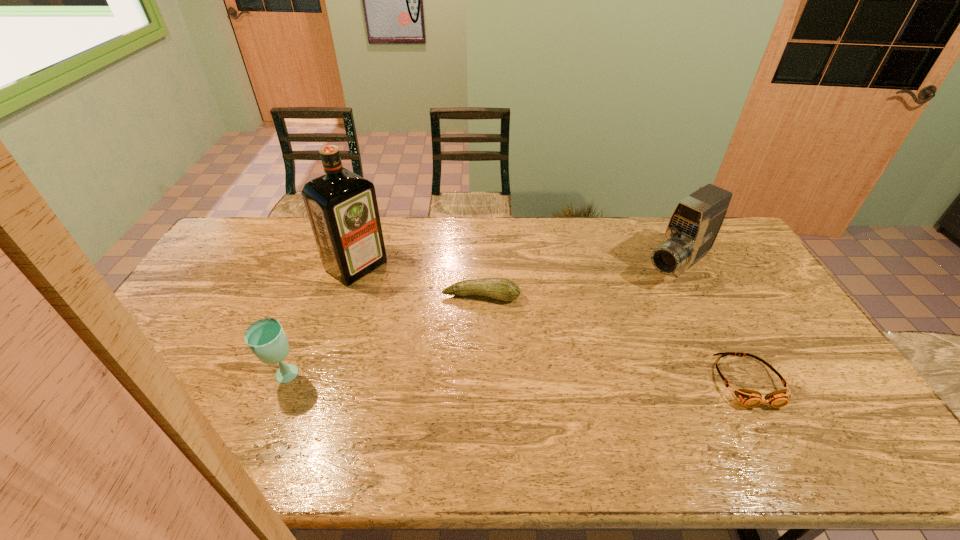
Find the location of a particular element. Image resolution: width=960 pixels, height=540 pixels. glass is located at coordinates (266, 338).

I want to click on the shortest object, so click(x=750, y=398).

This screenshot has height=540, width=960. I want to click on camcorder, so click(694, 224).

I want to click on the fourth tallest object, so (x=503, y=289).

Find the location of `the third object from right to left`. the third object from right to left is located at coordinates (503, 289).

Find the location of a particular element. The height and width of the screenshot is (540, 960). liquor is located at coordinates (342, 207).

The height and width of the screenshot is (540, 960). What are the coordinates of `vacant area situated 0.100m on the right of the glass` in the screenshot? It's located at (337, 377).

What are the coordinates of `vacant space located 0.400m at the front of the second tallest object, highlighting the lens` in the screenshot? It's located at (578, 346).

Find the location of a particular element. The width and height of the screenshot is (960, 540). vacant area situated 0.370m at the front of the second tallest object, highlighting the lens is located at coordinates (585, 340).

The height and width of the screenshot is (540, 960). Find the location of `free space located at the front of the second tallest object, highlighting the lens`. free space located at the front of the second tallest object, highlighting the lens is located at coordinates [636, 299].